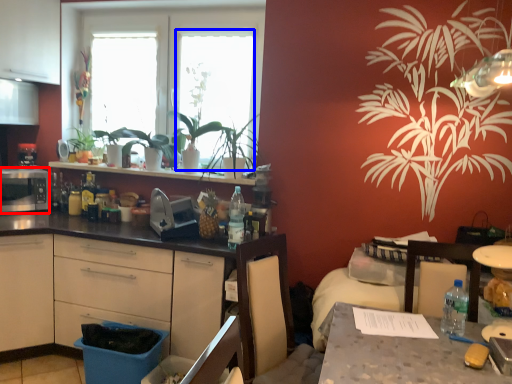
Question: Among these objects, which one is farthest to the camera, appliance (highlighted by a red box) or window screen (highlighted by a blue box)?

Choices:
 (A) appliance
 (B) window screen

Answer: (B)